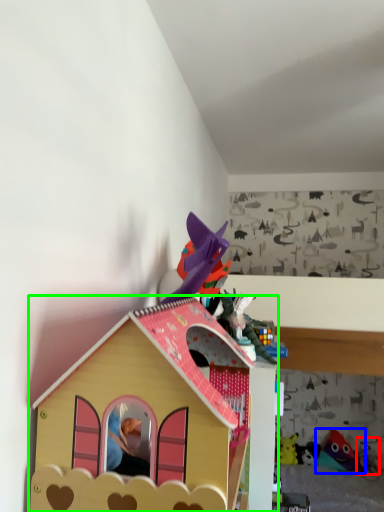
Question: Which object is the farthest from toy (highlighted by a red box)? Choose among these: toy (highlighted by a blue box) or toy (highlighted by a green box).

Choices:
 (A) toy
 (B) toy

Answer: (B)